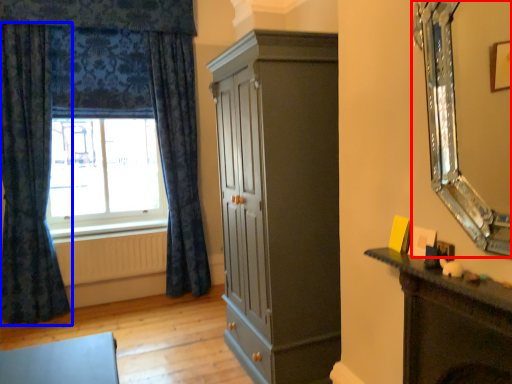
Question: Which object appears farthest to the camera in this image, mirror (highlighted by a red box) or curtain (highlighted by a blue box)?

Choices:
 (A) mirror
 (B) curtain

Answer: (B)